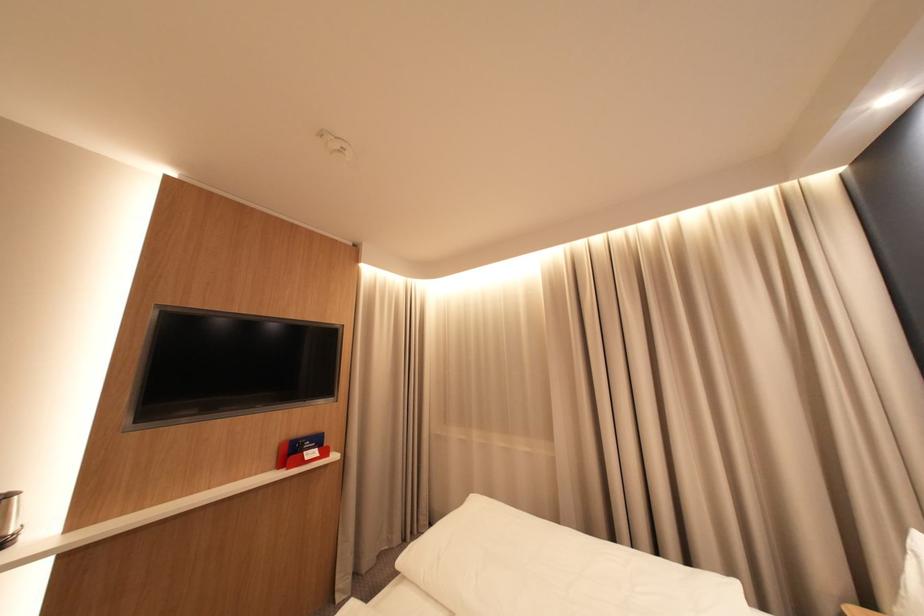
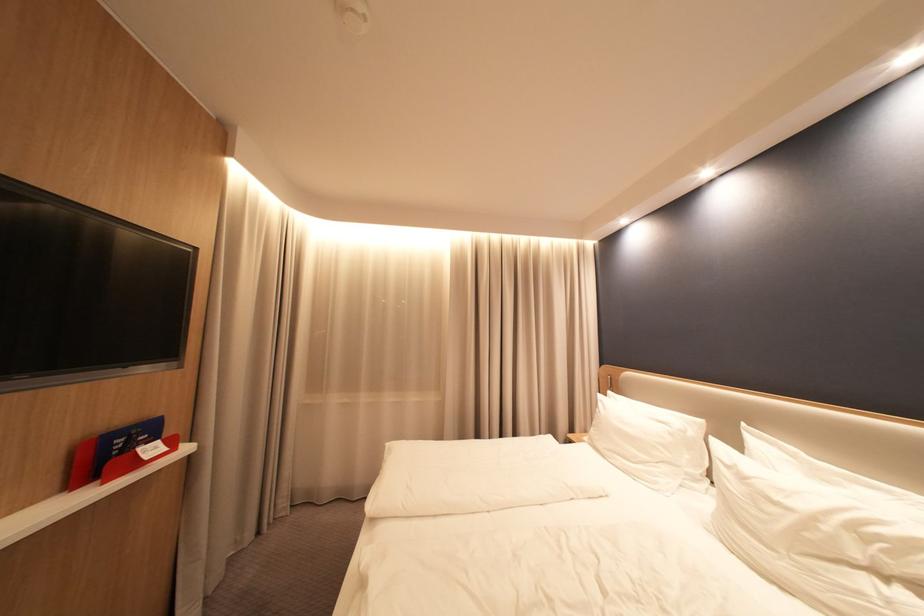
Locate, in the second image, the point that corresponds to (x=329, y=440) in the first image.

(160, 431)